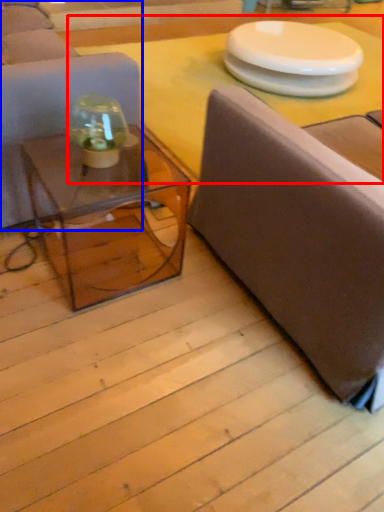
Question: Among these objects, which one is farthest to the camera, table top (highlighted by a red box) or studio couch (highlighted by a blue box)?

Choices:
 (A) table top
 (B) studio couch

Answer: (A)